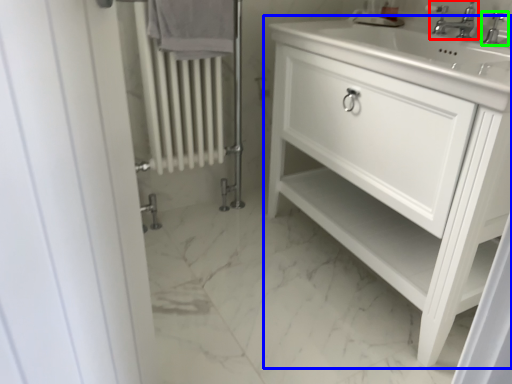
Question: Which object is the farthest from tap (highlighted by a red box)? Choose among these: bathroom cabinet (highlighted by a blue box) or tap (highlighted by a green box).

Choices:
 (A) bathroom cabinet
 (B) tap

Answer: (A)